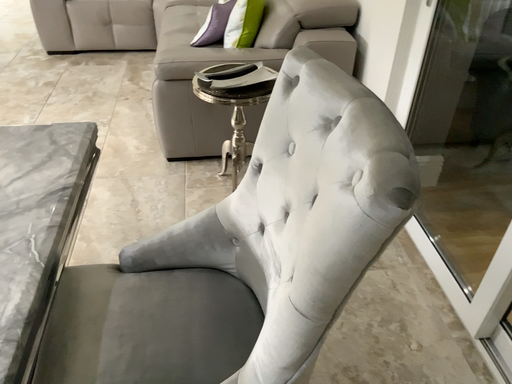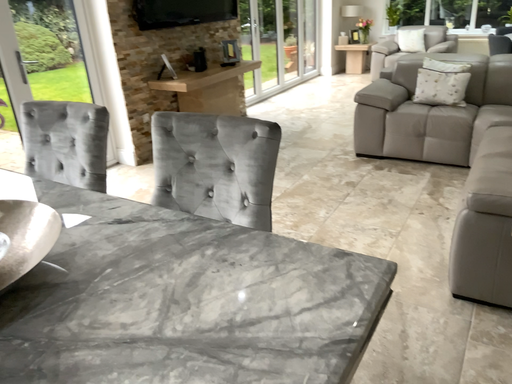
Question: Which way did the camera rotate in the video?

Choices:
 (A) rotated left
 (B) rotated right

Answer: (A)